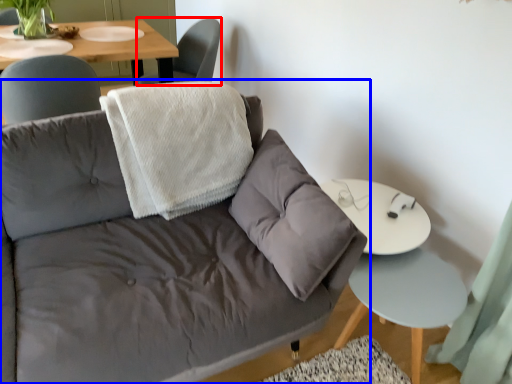
Question: Which object is further to the camera taking this photo, chair (highlighted by a red box) or studio couch (highlighted by a blue box)?

Choices:
 (A) chair
 (B) studio couch

Answer: (A)